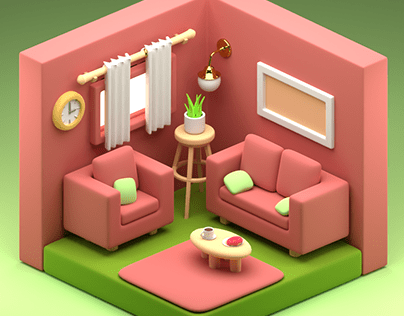
Locate an element on the screen. This screenshot has height=316, width=404. curtain rod is located at coordinates (82, 79), (192, 32).